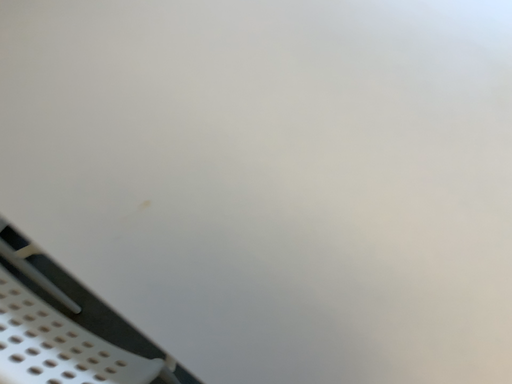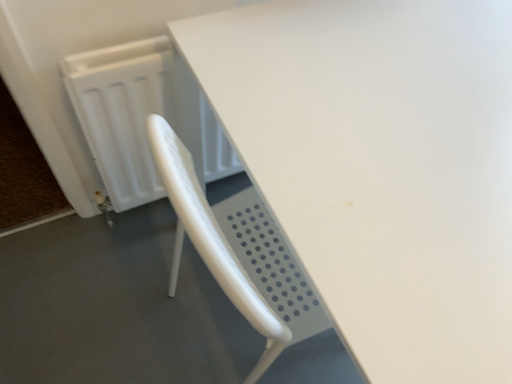
Question: Which way did the camera rotate in the video?

Choices:
 (A) rotated upward
 (B) rotated downward

Answer: (A)